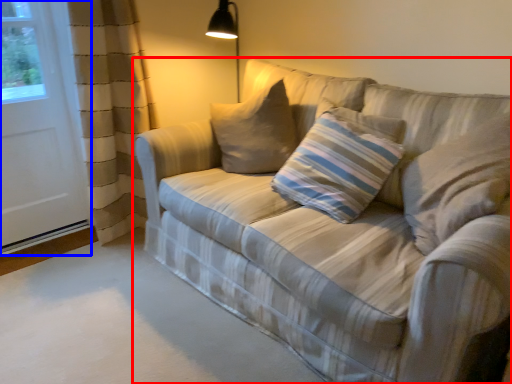
Question: Which point is further to the camera, studio couch (highlighted by a red box) or screen door (highlighted by a blue box)?

Choices:
 (A) studio couch
 (B) screen door

Answer: (B)